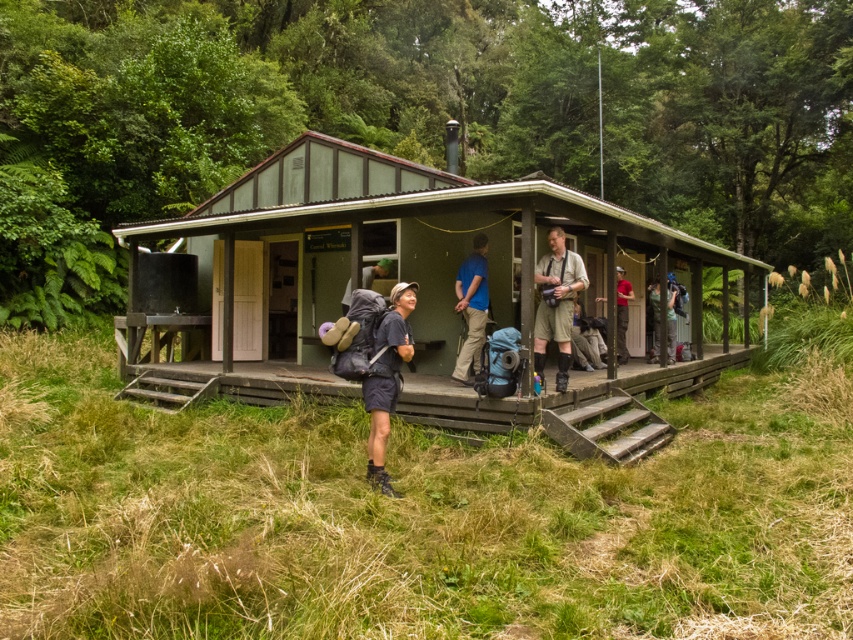
Question: Which is nearer to the matte black backpack at center?

Choices:
 (A) blue fabric backpack at center
 (B) matte gray backpack at center

Answer: (A)

Question: Can you confirm if khaki cotton shirt at center is positioned to the left of matte gray backpack at center?

Choices:
 (A) yes
 (B) no

Answer: (B)

Question: Can you confirm if matte black backpack at center is wider than matte gray backpack at center?

Choices:
 (A) no
 (B) yes

Answer: (B)

Question: Which point is farther to the camera?

Choices:
 (A) (619, 272)
 (B) (654, 276)

Answer: (B)

Question: Which point appears farthest from the camera in this image?

Choices:
 (A) (233, 292)
 (B) (363, 275)

Answer: (A)

Question: Where is wooden porch at center located in relation to khaki cotton shirt at center in the image?

Choices:
 (A) above
 (B) below

Answer: (B)